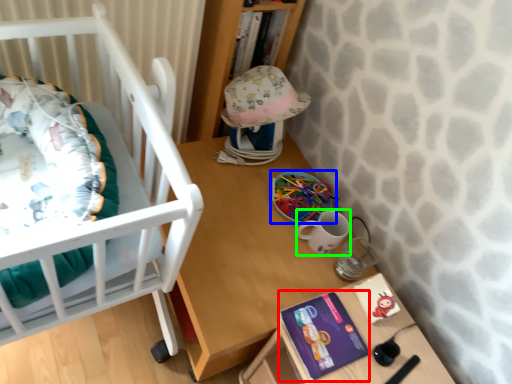
Question: Which is farther away from paperback book (highlighted by a red box)? toy (highlighted by a blue box) or mug (highlighted by a green box)?

Choices:
 (A) toy
 (B) mug

Answer: (A)